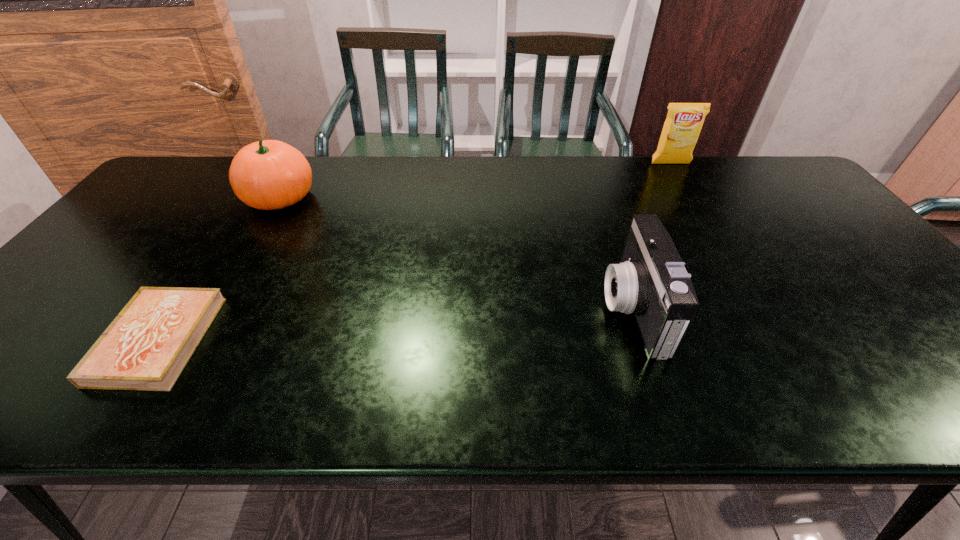
Locate an element on the screen. the rightmost object is located at coordinates (684, 121).

Identify the location of crisp (potato chip). (684, 121).

Identify the location of pumpkin. This screenshot has height=540, width=960. (269, 174).

Where is `camcorder`? camcorder is located at coordinates (651, 281).

Where is `the shortest object`? the shortest object is located at coordinates (146, 347).

In order to click on free space located on the front of the farthest object with the logo in this screenshot , I will do `click(713, 234)`.

The image size is (960, 540). What are the coordinates of `free region located on the left of the pumpkin` in the screenshot? It's located at (224, 198).

Find the location of `free region located on the lens of the third object from left to right`. free region located on the lens of the third object from left to right is located at coordinates (515, 309).

The image size is (960, 540). What are the coordinates of `free space located on the lens of the third object from left to right` in the screenshot? It's located at (467, 309).

This screenshot has height=540, width=960. I want to click on vacant area located on the lens of the third object from left to right, so click(441, 309).